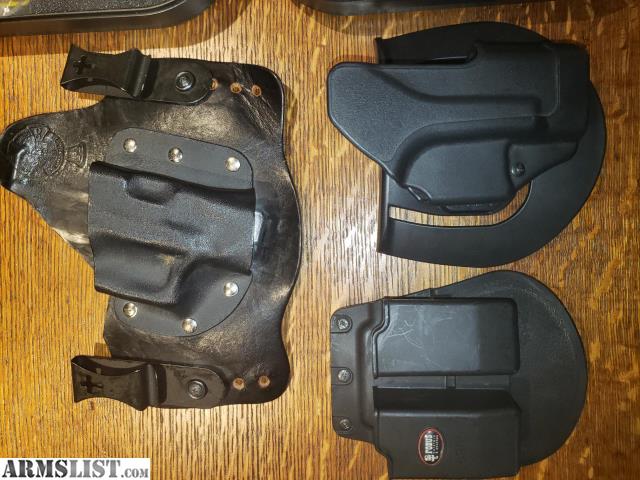
Find the location of `surface is a yellowish grained wood`. surface is a yellowish grained wood is located at coordinates (282, 42).